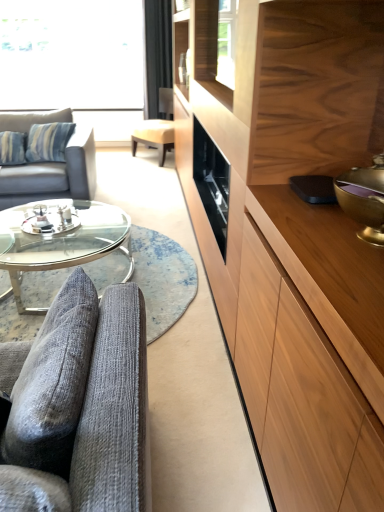
Question: Is light brown wood drawer at right shorter than black fabric curtain at upper center?

Choices:
 (A) no
 (B) yes

Answer: (B)

Question: Are light brown wood drawer at right and black fabric curtain at upper center far apart?

Choices:
 (A) yes
 (B) no

Answer: (A)

Question: From the image's perspective, is light brown wood drawer at right beneath black fabric curtain at upper center?

Choices:
 (A) yes
 (B) no

Answer: (A)

Question: Can you confirm if light brown wood drawer at right is thinner than black fabric curtain at upper center?

Choices:
 (A) yes
 (B) no

Answer: (A)

Question: Considering the relative sizes of light brown wood drawer at right and black fabric curtain at upper center in the image provided, is light brown wood drawer at right taller than black fabric curtain at upper center?

Choices:
 (A) yes
 (B) no

Answer: (B)

Question: Is light brown leather swivel chair at center taller or shorter than clear glass coffee table at center?

Choices:
 (A) tall
 (B) short

Answer: (A)

Question: From a real-world perspective, is light brown leather swivel chair at center positioned above or below clear glass coffee table at center?

Choices:
 (A) above
 (B) below

Answer: (A)

Question: Looking at their shapes, would you say light brown leather swivel chair at center is wider or thinner than clear glass coffee table at center?

Choices:
 (A) wide
 (B) thin

Answer: (B)

Question: Is light brown leather swivel chair at center inside the boundaries of clear glass coffee table at center, or outside?

Choices:
 (A) outside
 (B) inside

Answer: (A)

Question: Is point (238, 5) positioned closer to the camera than point (157, 5)?

Choices:
 (A) farther
 (B) closer

Answer: (B)

Question: Choose the correct answer: Is wooden cabinet at right inside black fabric curtain at upper center or outside it?

Choices:
 (A) inside
 (B) outside

Answer: (B)

Question: Is wooden cabinet at right in front of or behind black fabric curtain at upper center in the image?

Choices:
 (A) front
 (B) behind

Answer: (A)

Question: From the image's perspective, is wooden cabinet at right located above or below black fabric curtain at upper center?

Choices:
 (A) below
 (B) above

Answer: (A)

Question: Considering the positions of light brown wood drawer at right and transparent glass window at upper left in the image, is light brown wood drawer at right taller or shorter than transparent glass window at upper left?

Choices:
 (A) tall
 (B) short

Answer: (B)

Question: Is light brown wood drawer at right bigger or smaller than transparent glass window at upper left?

Choices:
 (A) small
 (B) big

Answer: (A)